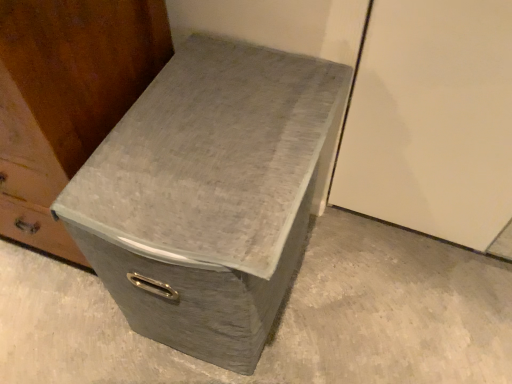
Question: From a real-world perspective, is matte gray storage box at center below gray fabric storage bin at center?

Choices:
 (A) no
 (B) yes

Answer: (A)

Question: From the image's perspective, is matte gray storage box at center on top of gray fabric storage bin at center?

Choices:
 (A) yes
 (B) no

Answer: (A)

Question: Can you confirm if matte gray storage box at center is smaller than gray fabric storage bin at center?

Choices:
 (A) no
 (B) yes

Answer: (A)

Question: Does matte gray storage box at center have a greater width compared to gray fabric storage bin at center?

Choices:
 (A) no
 (B) yes

Answer: (A)

Question: Considering the relative sizes of matte gray storage box at center and gray fabric storage bin at center in the image provided, is matte gray storage box at center taller than gray fabric storage bin at center?

Choices:
 (A) yes
 (B) no

Answer: (A)

Question: Is matte gray storage box at center inside or outside of gray fabric storage bin at center?

Choices:
 (A) inside
 (B) outside

Answer: (B)

Question: Considering the positions of point (60, 77) and point (106, 359), is point (60, 77) closer or farther from the camera than point (106, 359)?

Choices:
 (A) closer
 (B) farther

Answer: (A)

Question: From a real-world perspective, relative to gray fabric storage bin at center, is matte gray storage box at center vertically above or below?

Choices:
 (A) below
 (B) above

Answer: (B)

Question: From the image's perspective, is matte gray storage box at center above or below gray fabric storage bin at center?

Choices:
 (A) below
 (B) above

Answer: (B)

Question: Is point (123, 329) closer or farther from the camera than point (184, 89)?

Choices:
 (A) farther
 (B) closer

Answer: (A)

Question: From a real-world perspective, is gray fabric storage bin at center above or below gray fabric shoe box at center?

Choices:
 (A) below
 (B) above

Answer: (A)

Question: In the image, is gray fabric storage bin at center positioned in front of or behind gray fabric shoe box at center?

Choices:
 (A) behind
 (B) front

Answer: (A)

Question: In terms of height, does gray fabric storage bin at center look taller or shorter compared to gray fabric shoe box at center?

Choices:
 (A) short
 (B) tall

Answer: (A)

Question: Is matte gray storage box at center to the left or to the right of gray fabric shoe box at center in the image?

Choices:
 (A) left
 (B) right

Answer: (A)

Question: Based on their sizes in the image, would you say matte gray storage box at center is bigger or smaller than gray fabric shoe box at center?

Choices:
 (A) small
 (B) big

Answer: (B)